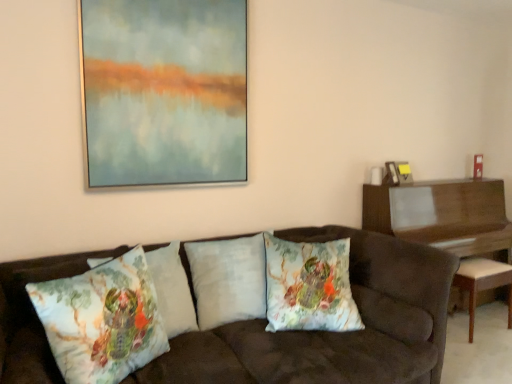
Question: Does white fabric stool at right have a lesser height compared to floral-patterned fabric pillow at center, positioned as the fourth pillow in right-to-left order?

Choices:
 (A) yes
 (B) no

Answer: (B)

Question: Does white fabric stool at right turn towards floral-patterned fabric pillow at center, positioned as the fourth pillow in right-to-left order?

Choices:
 (A) no
 (B) yes

Answer: (A)

Question: Can you confirm if white fabric stool at right is wider than floral-patterned fabric pillow at center, positioned as the fourth pillow in right-to-left order?

Choices:
 (A) no
 (B) yes

Answer: (B)

Question: Is white fabric stool at right directly adjacent to floral-patterned fabric pillow at center, positioned as the fourth pillow in right-to-left order?

Choices:
 (A) no
 (B) yes

Answer: (A)

Question: Is white fabric stool at right not inside floral-patterned fabric pillow at center, the first pillow viewed from the left?

Choices:
 (A) yes
 (B) no

Answer: (A)

Question: Can you confirm if white fabric stool at right is thinner than floral-patterned fabric pillow at center, the first pillow viewed from the left?

Choices:
 (A) no
 (B) yes

Answer: (A)

Question: Would you say wooden piano at right contains floral cotton cushion at center, acting as the fourth pillow starting from the left?

Choices:
 (A) yes
 (B) no

Answer: (B)

Question: Does wooden piano at right have a greater width compared to floral cotton cushion at center, acting as the fourth pillow starting from the left?

Choices:
 (A) no
 (B) yes

Answer: (B)

Question: Is wooden piano at right outside of floral cotton cushion at center, acting as the fourth pillow starting from the left?

Choices:
 (A) no
 (B) yes

Answer: (B)

Question: Considering the relative positions of wooden piano at right and floral cotton cushion at center, positioned as the 1th pillow in right-to-left order, in the image provided, is wooden piano at right behind floral cotton cushion at center, positioned as the 1th pillow in right-to-left order,?

Choices:
 (A) no
 (B) yes

Answer: (B)

Question: Considering the relative sizes of wooden piano at right and floral cotton cushion at center, positioned as the 1th pillow in right-to-left order, in the image provided, is wooden piano at right smaller than floral cotton cushion at center, positioned as the 1th pillow in right-to-left order,?

Choices:
 (A) yes
 (B) no

Answer: (B)

Question: Is wooden piano at right thinner than floral cotton cushion at center, acting as the fourth pillow starting from the left?

Choices:
 (A) no
 (B) yes

Answer: (A)

Question: From a real-world perspective, is floral cotton cushion at center, positioned as the 1th pillow in right-to-left order, beneath matte glass painting at upper center, the first picture frame from the front?

Choices:
 (A) yes
 (B) no

Answer: (A)